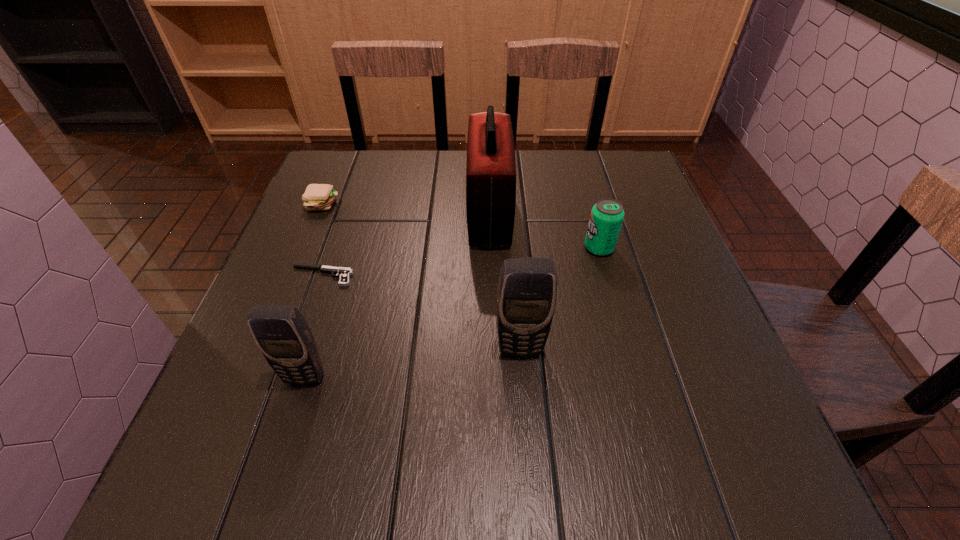
You are a GUI agent. You are given a task and a screenshot of the screen. Output one action in this format:
    pyautogui.click(x=<x>, y=<y>)
    Task: Click on the first aid kit present at the far edge
    
    Given the screenshot: What is the action you would take?
    pyautogui.click(x=491, y=167)

The width and height of the screenshot is (960, 540). Find the location of `object that is positioned at the near edge`. object that is positioned at the near edge is located at coordinates (283, 336).

Where is `cellular telephone present at the left edge`? cellular telephone present at the left edge is located at coordinates (283, 336).

Identify the location of patty located at the left edge. The height and width of the screenshot is (540, 960). (317, 196).

Locate an element on the screen. pistol situated at the left edge is located at coordinates (343, 273).

Where is `object that is at the right edge`? The height and width of the screenshot is (540, 960). object that is at the right edge is located at coordinates (607, 215).

Image resolution: width=960 pixels, height=540 pixels. Find the location of `object that is positioned at the far left corner`. object that is positioned at the far left corner is located at coordinates (317, 196).

Locate an element on the screen. This screenshot has width=960, height=540. object that is at the near left corner is located at coordinates (283, 336).

Identify the location of free space at the far edge of the desktop. The height and width of the screenshot is (540, 960). (517, 198).

Identify the location of free space at the near edge of the desktop. (333, 415).